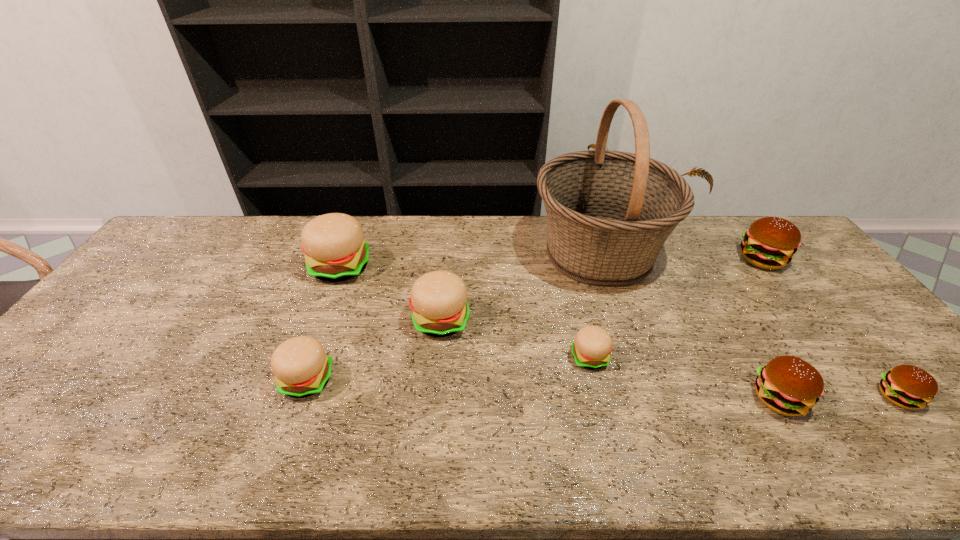
Where is `basket`? The width and height of the screenshot is (960, 540). basket is located at coordinates (609, 213).

Where is `the farthest beige hamburger`? Image resolution: width=960 pixels, height=540 pixels. the farthest beige hamburger is located at coordinates (333, 244).

Where is `the biggest brown hamburger`? The height and width of the screenshot is (540, 960). the biggest brown hamburger is located at coordinates (770, 242).

I want to click on the fifth nearest hamburger, so click(438, 299).

Find the location of a particular element. The height and width of the screenshot is (540, 960). the third nearest beige hamburger is located at coordinates (438, 299).

Find the location of a particular element. This screenshot has width=960, height=540. the leftmost brown hamburger is located at coordinates (788, 385).

Locate an element on the screen. This screenshot has height=540, width=960. the second biggest brown hamburger is located at coordinates (788, 385).

Locate an element on the screen. the second smallest beige hamburger is located at coordinates (301, 367).

The height and width of the screenshot is (540, 960). What are the coordinates of `the smallest brown hamburger` in the screenshot? It's located at (906, 386).

You are a GUI agent. You are given a task and a screenshot of the screen. Output one action in this format:
    pyautogui.click(x=<x>, y=<y>)
    Task: Click on the fourth hamburger from right to left
    The width and height of the screenshot is (960, 540).
    Given the screenshot: What is the action you would take?
    pyautogui.click(x=591, y=349)